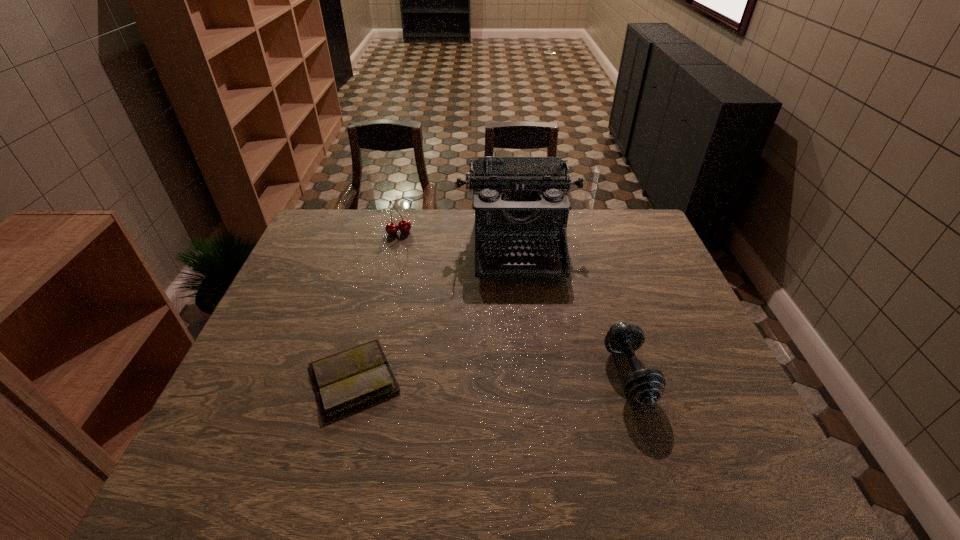
In the image, there is a desktop. Where is `free region at the far left corner`? This screenshot has width=960, height=540. free region at the far left corner is located at coordinates (329, 222).

Find the location of `vacant space at the far right corner`. vacant space at the far right corner is located at coordinates (638, 239).

Locate an element on the screen. free area in between the diary and the cherry is located at coordinates (376, 305).

What are the coordinates of `unoccupied area between the cherry and the second shortest object` in the screenshot? It's located at (514, 303).

You are a GUI agent. You are given a task and a screenshot of the screen. Output one action in this format:
    pyautogui.click(x=<x>, y=<y>)
    Task: Click on the unoccupied area between the dumbbell and the diary
    The width and height of the screenshot is (960, 540).
    Given the screenshot: What is the action you would take?
    pyautogui.click(x=492, y=376)

Find the location of a particular element. This screenshot has height=540, width=960. blank region between the dumbbell and the typewriter is located at coordinates (573, 309).

I want to click on free area in between the diary and the typewriter, so click(x=436, y=312).

Where is `empty space between the shortest object and the cherry`? The image size is (960, 540). empty space between the shortest object and the cherry is located at coordinates (376, 305).

Find the location of a particular element. This screenshot has width=960, height=540. vacant space in between the dumbbell and the cherry is located at coordinates (514, 303).

Where is `unoccupied position between the dumbbell and the tallest object`? unoccupied position between the dumbbell and the tallest object is located at coordinates (573, 309).